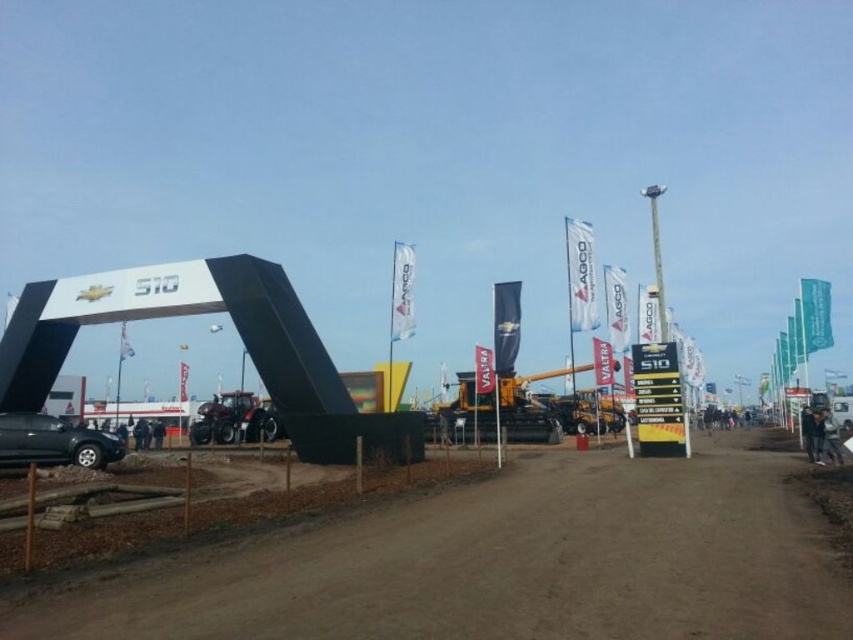
Question: Which object is farther from the camera taking this photo?

Choices:
 (A) matte black suv at lower left
 (B) metallic red tractor at center

Answer: (B)

Question: Is brown dirt track at center to the right of metallic red tractor at center from the viewer's perspective?

Choices:
 (A) no
 (B) yes

Answer: (B)

Question: Which is farther from the matte black suv at lower left?

Choices:
 (A) brown dirt track at center
 (B) metallic red tractor at center

Answer: (B)

Question: Which point is farther to the camera?

Choices:
 (A) (202, 404)
 (B) (68, 429)
 (C) (585, 600)

Answer: (A)

Question: Is brown dirt track at center to the right of metallic red tractor at center from the viewer's perspective?

Choices:
 (A) no
 (B) yes

Answer: (B)

Question: Can you confirm if brown dirt track at center is positioned below matte black suv at lower left?

Choices:
 (A) yes
 (B) no

Answer: (A)